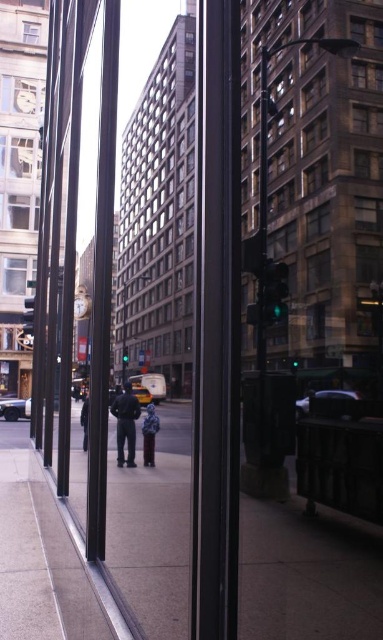
Who is lower down, dark blue jeans at center or blue denim jacket at center?

dark blue jeans at center

Can you confirm if dark blue jeans at center is shorter than blue denim jacket at center?

No, dark blue jeans at center is not shorter than blue denim jacket at center.

This screenshot has width=383, height=640. Describe the element at coordinates (126, 422) in the screenshot. I see `dark blue jeans at center` at that location.

Image resolution: width=383 pixels, height=640 pixels. What are the coordinates of `dark blue jeans at center` in the screenshot? It's located at (126, 422).

Can you confirm if blue denim jacket at center is smaller than clear glass window at upper left?

Yes.

Is blue denim jacket at center further to camera compared to clear glass window at upper left?

No, blue denim jacket at center is in front of clear glass window at upper left.

Image resolution: width=383 pixels, height=640 pixels. Describe the element at coordinates (150, 435) in the screenshot. I see `blue denim jacket at center` at that location.

This screenshot has width=383, height=640. Identify the location of blue denim jacket at center. (150, 435).

Who is positioned more to the left, blue denim jacket at center or dark blue jacket at center?

dark blue jacket at center is more to the left.

Based on the photo, does blue denim jacket at center have a lesser height compared to dark blue jacket at center?

Yes.

Who is more forward, (153, 449) or (85, 410)?

Point (153, 449)

Image resolution: width=383 pixels, height=640 pixels. What are the coordinates of `blue denim jacket at center` in the screenshot? It's located at (150, 435).